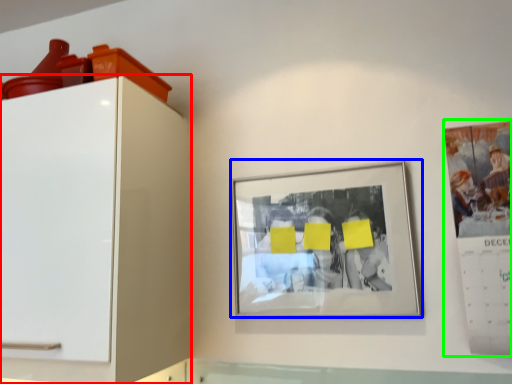
Question: Estimate the real-world distances between objects in this image. Which object is farther from furniture (highlighted by a red box), picture frame (highlighted by a blue box) or poster (highlighted by a green box)?

Choices:
 (A) picture frame
 (B) poster

Answer: (B)